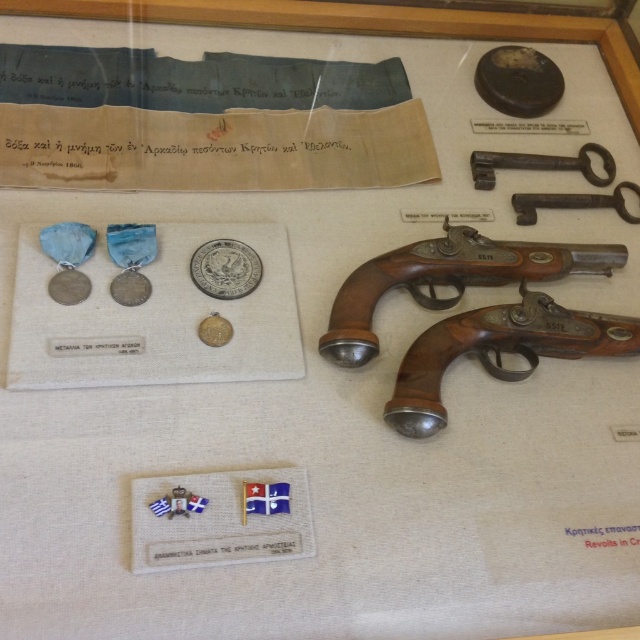
Is silver/brass coin at center thinner than silver metallic coin at center-left?

No, silver/brass coin at center is not thinner than silver metallic coin at center-left.

Is silver/brass coin at center shorter than silver metallic coin at center-left?

No, silver/brass coin at center is not shorter than silver metallic coin at center-left.

Locate an element on the screen. silver/brass coin at center is located at coordinates (225, 268).

Can you confirm if silver/brass coin at center is positioned to the right of gold plated coin at center?

Correct, you'll find silver/brass coin at center to the right of gold plated coin at center.

Between silver/brass coin at center and gold plated coin at center, which one is positioned higher?

silver/brass coin at center is higher up.

Measure the distance between point (244, 266) and camera.

1.23 meters

Where is `silver/brass coin at center`? The width and height of the screenshot is (640, 640). silver/brass coin at center is located at coordinates (225, 268).

Who is positioned more to the left, silver/brass coin at center or silver metallic coin at upper left?

silver metallic coin at upper left

Does point (253, 253) come closer to viewer compared to point (49, 296)?

No.

Where is `silver/brass coin at center`? The image size is (640, 640). silver/brass coin at center is located at coordinates (225, 268).